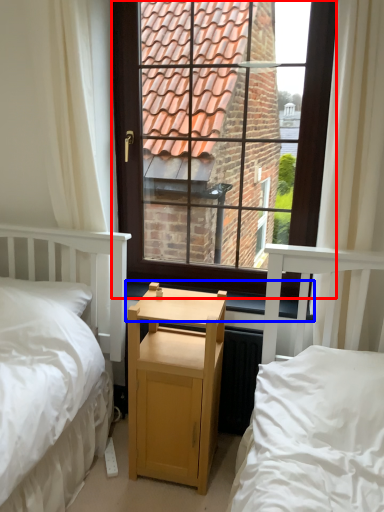
Question: Which of the following is the closest to the observer, window (highlighted by a red box) or window sill (highlighted by a blue box)?

Choices:
 (A) window
 (B) window sill

Answer: (A)